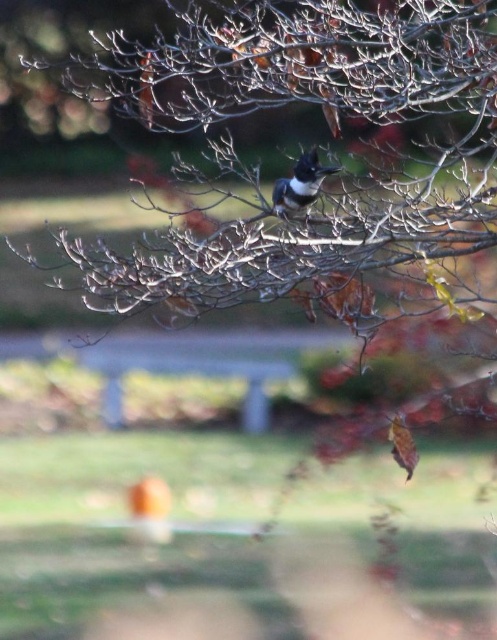
You are a photographer trying to capture the bird on the brown matte branch at upper center. You notice the wooden park bench at center might block your shot. Based on their sizes, which object would you need to move closer to or farther from to ensure the bird is the main focus?

The brown matte branch at upper center is larger than the wooden park bench at center. To ensure the bird on the branch is the main focus, you should move closer to the brown matte branch at upper center so its size dominates the frame, minimizing the bench at center in the background.